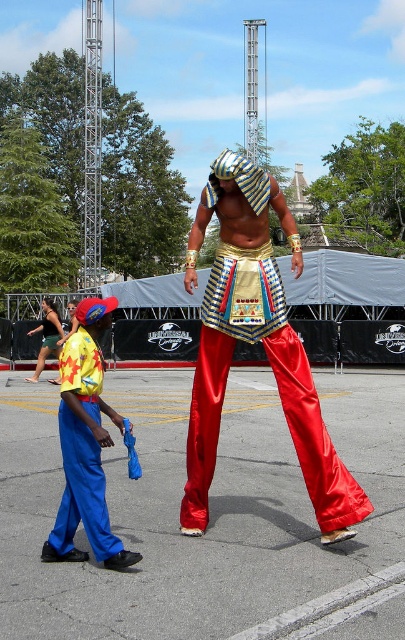
Question: Which point is closer to the camera taking this photo?

Choices:
 (A) click(x=80, y=508)
 (B) click(x=285, y=408)

Answer: (A)

Question: Which point is farther to the camera?

Choices:
 (A) (302, 410)
 (B) (81, 502)

Answer: (A)

Question: Is shiny red pants at center behind blue satin pants at lower left?

Choices:
 (A) no
 (B) yes

Answer: (B)

Question: Does shiny red pants at center come behind blue satin pants at lower left?

Choices:
 (A) no
 (B) yes

Answer: (B)

Question: In this image, where is shiny red pants at center located relative to blue satin pants at lower left?

Choices:
 (A) left
 (B) right

Answer: (B)